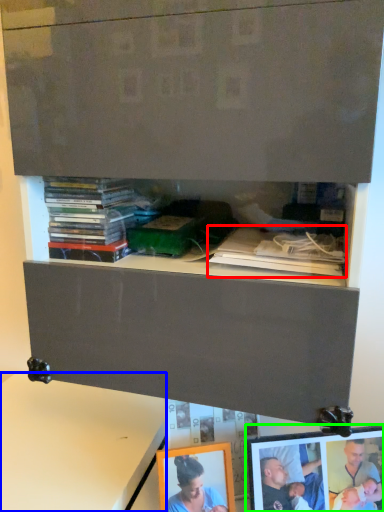
Question: Estimate the real-world distances between objects in this image. Which object is closer to book (highlighted by a red box), table (highlighted by a blue box) or picture frame (highlighted by a green box)?

Choices:
 (A) table
 (B) picture frame

Answer: (B)